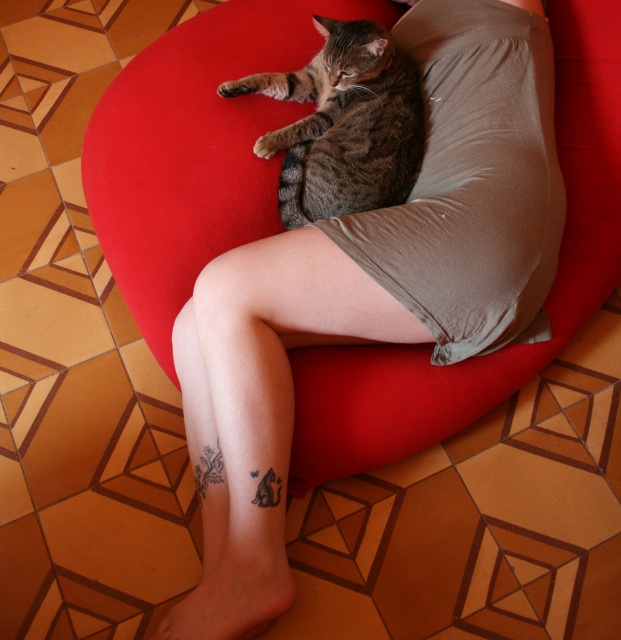
Does point (193, 112) lie in front of point (283, 196)?

That is False.

Between velvet red bean bag chair at center and tabby fur cat at center, which one appears on the left side from the viewer's perspective?

Positioned to the left is tabby fur cat at center.

Who is more distant from viewer, (153, 253) or (302, 172)?

Point (153, 253)

Find the location of a particular element. This screenshot has height=640, width=621. velvet red bean bag chair at center is located at coordinates (194, 148).